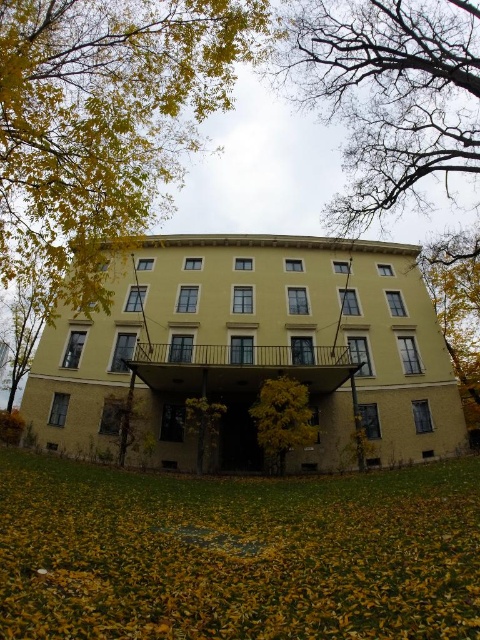
You are standing in front of the building and notice two trees. One is the bare branches at upper center and the other is the green leafy tree at center. Which tree is taller?

The bare branches at upper center is taller than the green leafy tree at center.

You are standing at the entrance of the multi story building with a light yellow facade. You want to take a photo of the point at coordinate point (432, 90). Is the point close enough to be captured clearly in your photo?

The distance of point (432, 90) from camera is 85.08 feet, so the point is far away and may not be captured clearly in the photo.